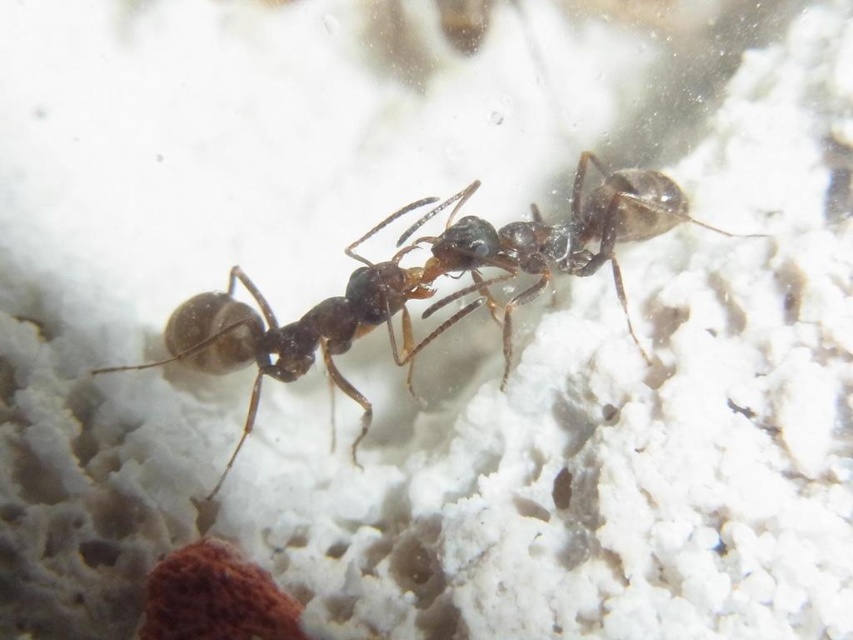
Question: Is the position of brown glossy ant at center more distant than that of shiny black ant at center?

Choices:
 (A) no
 (B) yes

Answer: (A)

Question: Which object appears farthest from the camera in this image?

Choices:
 (A) shiny black ant at center
 (B) brown glossy ant at center

Answer: (A)

Question: Is brown glossy ant at center above shiny black ant at center?

Choices:
 (A) no
 (B) yes

Answer: (A)

Question: Which point is closer to the camera?

Choices:
 (A) (228, 289)
 (B) (654, 218)

Answer: (B)

Question: Which of the following is the closest to the observer?

Choices:
 (A) (405, 380)
 (B) (627, 212)

Answer: (B)

Question: Does brown glossy ant at center come behind shiny black ant at center?

Choices:
 (A) no
 (B) yes

Answer: (A)